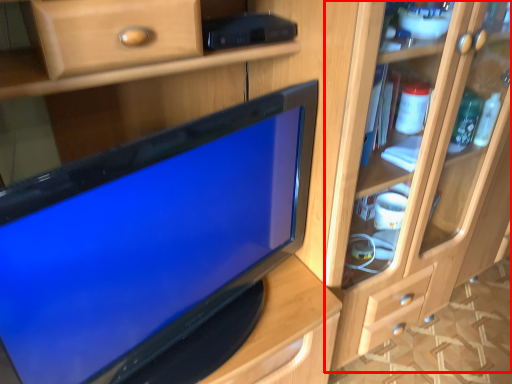
Question: In this image, where is dresser (annotated by the red box) located relative to television?

Choices:
 (A) right
 (B) left

Answer: (A)